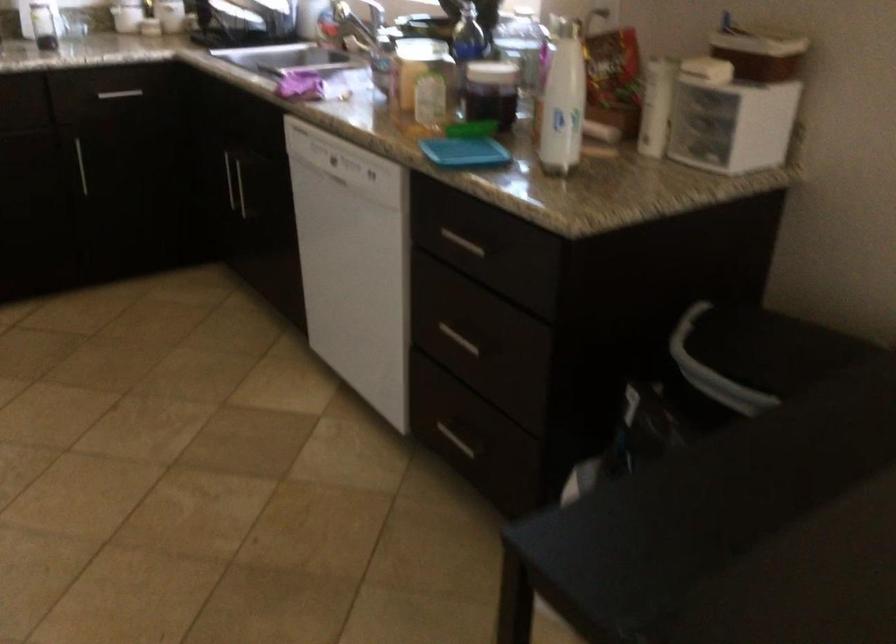
The images are taken continuously from a first-person perspective. In which direction is your viewpoint rotating?

The camera's rotation is toward right-down.